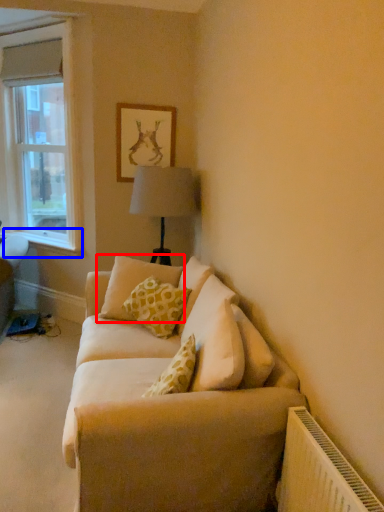
Question: Which object appears farthest to the camera in this image, pillow (highlighted by a red box) or window sill (highlighted by a blue box)?

Choices:
 (A) pillow
 (B) window sill

Answer: (B)